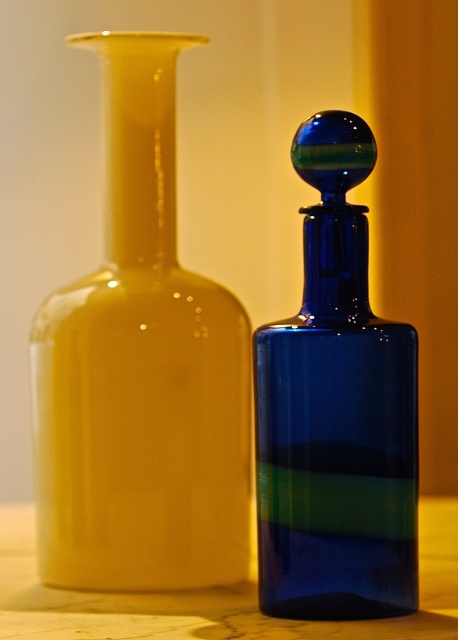
You are standing in front of two points marked on a glass bottle. The points are labeled as point 1 at coordinates point (x=393, y=525) and point 2 at coordinates point (x=440, y=534). Which point is closer to you?

Point (x=393, y=525) is closer to the viewer than point (x=440, y=534).

You are a delivery person who needs to place a small box on the wooden table at center. The box is 4 inches wide. Can you safely place it on the table without it overlapping the matte yellow glass vase at left?

The distance between the matte yellow glass vase at left and the wooden table at center is 4.14 inches, which is slightly larger than the box width of 4 inches. Therefore, you can safely place the box on the table without overlapping the vase.

You are an interior designer arranging a shelf. You have a matte yellow glass vase at left and a dark blue bottle with spherical stopper at right. A client wants to place a decorative item at the coordinate point (141, 371). Which object should you place it near?

The point (141, 371) corresponds to the matte yellow glass vase at left, so you should place the decorative item near the matte yellow glass vase at left.